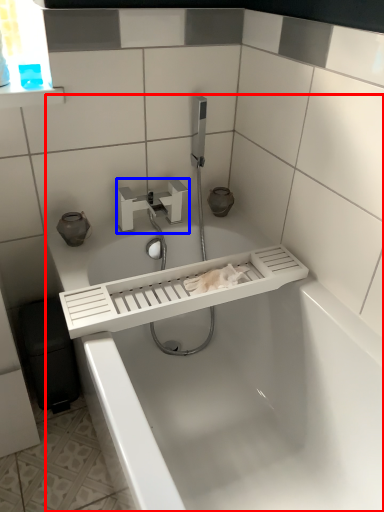
Question: Which object appears farthest to the camera in this image, bathtub (highlighted by a red box) or tap (highlighted by a blue box)?

Choices:
 (A) bathtub
 (B) tap

Answer: (B)